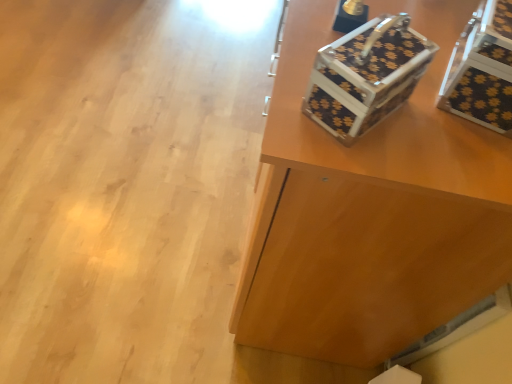
Question: Can you confirm if black textured suitcase at upper right is thinner than black textured storage box at upper right?

Choices:
 (A) no
 (B) yes

Answer: (A)

Question: Can you confirm if black textured suitcase at upper right is wider than black textured storage box at upper right?

Choices:
 (A) no
 (B) yes

Answer: (B)

Question: Is black textured suitcase at upper right beside black textured storage box at upper right?

Choices:
 (A) yes
 (B) no

Answer: (B)

Question: Are black textured suitcase at upper right and black textured storage box at upper right far apart?

Choices:
 (A) yes
 (B) no

Answer: (B)

Question: Does black textured suitcase at upper right lie behind black textured storage box at upper right?

Choices:
 (A) no
 (B) yes

Answer: (B)

Question: Does black textured suitcase at upper right appear on the right side of black textured storage box at upper right?

Choices:
 (A) no
 (B) yes

Answer: (A)

Question: Is black textured suitcase at upper right not inside metallic floral-patterned shoe box at upper right?

Choices:
 (A) yes
 (B) no

Answer: (A)

Question: Does black textured suitcase at upper right touch metallic floral-patterned shoe box at upper right?

Choices:
 (A) no
 (B) yes

Answer: (A)

Question: Does black textured suitcase at upper right have a greater height compared to metallic floral-patterned shoe box at upper right?

Choices:
 (A) no
 (B) yes

Answer: (B)

Question: Considering the relative positions of black textured suitcase at upper right and metallic floral-patterned shoe box at upper right in the image provided, is black textured suitcase at upper right behind metallic floral-patterned shoe box at upper right?

Choices:
 (A) yes
 (B) no

Answer: (A)

Question: From the image's perspective, is black textured suitcase at upper right located above metallic floral-patterned shoe box at upper right?

Choices:
 (A) no
 (B) yes

Answer: (B)

Question: Would you say metallic floral-patterned shoe box at upper right is part of black textured suitcase at upper right's contents?

Choices:
 (A) yes
 (B) no

Answer: (B)

Question: Does metallic floral-patterned shoe box at upper right have a larger size compared to black textured storage box at upper right?

Choices:
 (A) yes
 (B) no

Answer: (B)